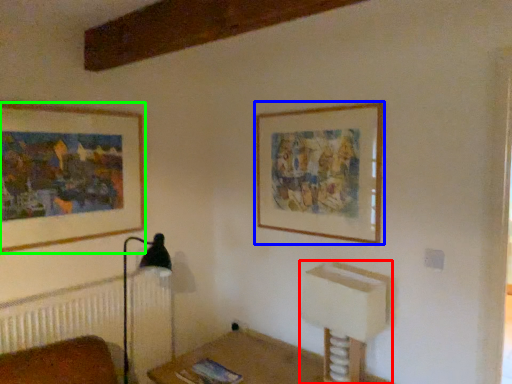
Question: Which object is positioned closest to vanity (highlighted by a red box)? Select from picture frame (highlighted by a blue box) and picture frame (highlighted by a green box).

Choices:
 (A) picture frame
 (B) picture frame

Answer: (A)